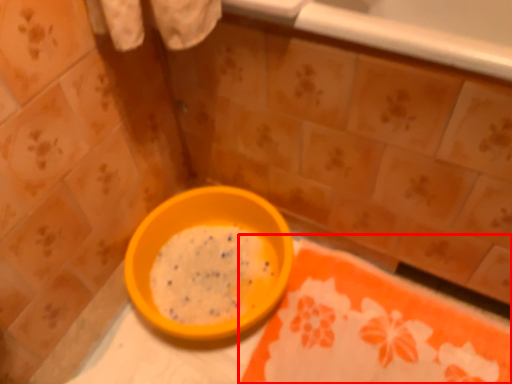
Question: From the image's perspective, what is the correct spatial relationship of tablecloth (annotated by the red box) in relation to bowl?

Choices:
 (A) above
 (B) below

Answer: (B)